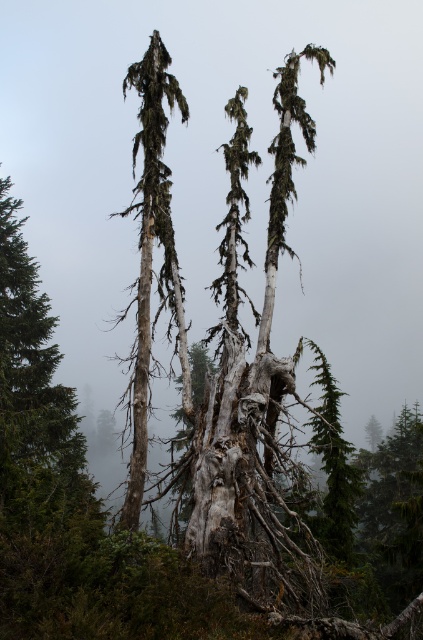
Question: Can you confirm if gray bark tree at center is thinner than green textured pine tree at center?

Choices:
 (A) no
 (B) yes

Answer: (A)

Question: Does gray bark tree at center appear under green textured pine tree at center?

Choices:
 (A) no
 (B) yes

Answer: (A)

Question: Does gray bark tree at center appear on the left side of green textured pine tree at center?

Choices:
 (A) no
 (B) yes

Answer: (B)